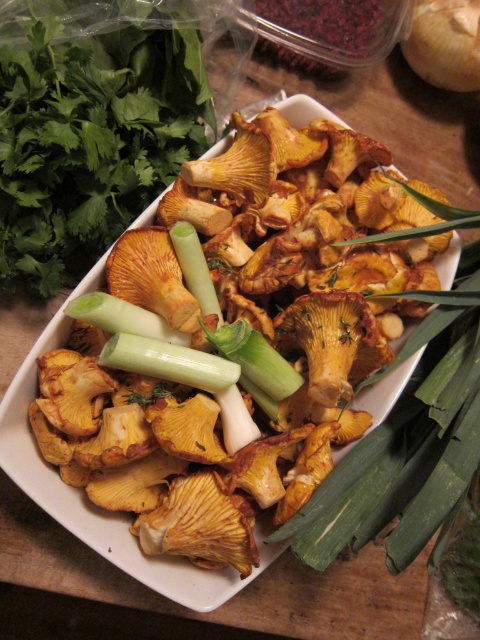
You are holding a 100 cm long wooden spoon and want to stir the dish at point (277, 253). Can you reach it without moving your position?

The point (277, 253) is 92.90 centimeters away from you. Since your wooden spoon is 100 cm long, you can reach it by extending the spoon fully.

What is located at the point with coordinates (229, 332) in the image?

The point at coordinates (229, 332) is located at yellowish brown textured mushrooms at center.